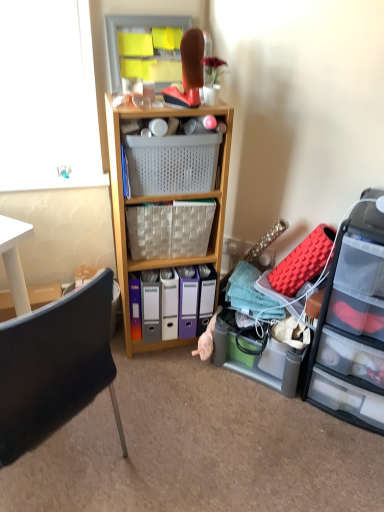
Locate an element on the screen. The height and width of the screenshot is (512, 384). vacant area that is situated to the right of black plastic chair at lower left is located at coordinates (186, 448).